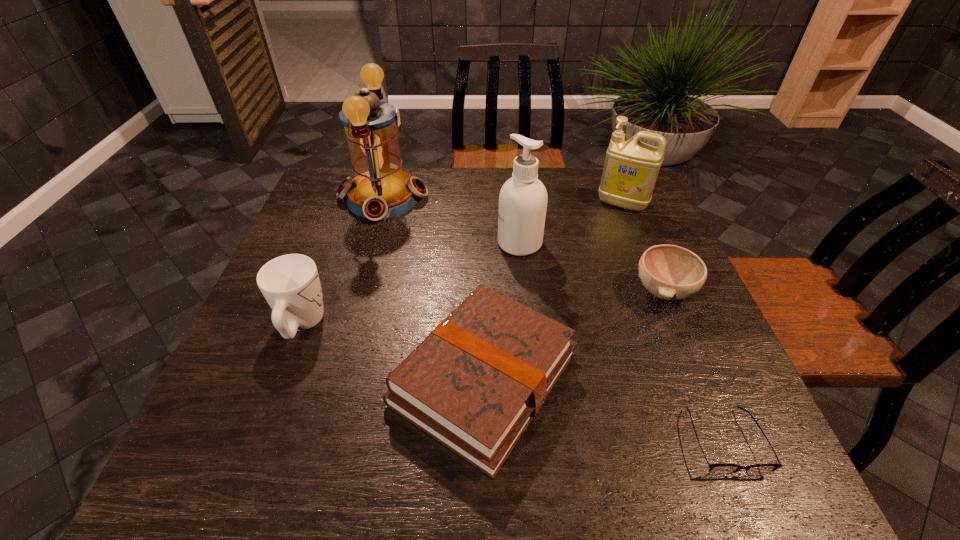
Locate an element on the screen. This screenshot has height=540, width=960. vacant area that lies between the third farthest object and the shortest object is located at coordinates (621, 342).

What are the coordinates of `free space between the bowl and the fifth shortest object` in the screenshot? It's located at (643, 247).

Find the location of a particular element. vacant space that is in between the mug and the detergent is located at coordinates (462, 264).

Identify which object is the second nearest to the third tallest object. Please provide its 2D coordinates. Your answer should be formatted as a tuple, i.e. [(x, y)], where the tuple contains the x and y coordinates of a point satisfying the conditions above.

[(670, 272)]

The width and height of the screenshot is (960, 540). I want to click on object that can be found as the fifth closest to the bowl, so click(380, 189).

Find the location of a particular element. Image resolution: width=960 pixels, height=540 pixels. free location that satisfies the following two spatial constraints: 1. on the back side of the bowl; 2. on the left side of the hardback book is located at coordinates (484, 291).

Find the location of a particular element. Image resolution: width=960 pixels, height=540 pixels. vacant region that satisfies the following two spatial constraints: 1. on the front label of the cleansing agent; 2. on the front side of the hardback book is located at coordinates (534, 378).

At what (x,y) coordinates should I click in order to perform the action: click on free space in the image that satisfies the following two spatial constraints: 1. on the back side of the bowl; 2. on the front-facing side of the lantern. Please return your answer as a coordinate pair (x, y). Looking at the image, I should click on (625, 198).

What are the coordinates of `free location that satisfies the following two spatial constraints: 1. on the side of the fifth shortest object with the handle; 2. on the left side of the mug` in the screenshot? It's located at (347, 204).

Find the location of a particular element. The image size is (960, 540). vacant space that satisfies the following two spatial constraints: 1. on the front label of the bowl; 2. on the left side of the cleansing agent is located at coordinates (524, 291).